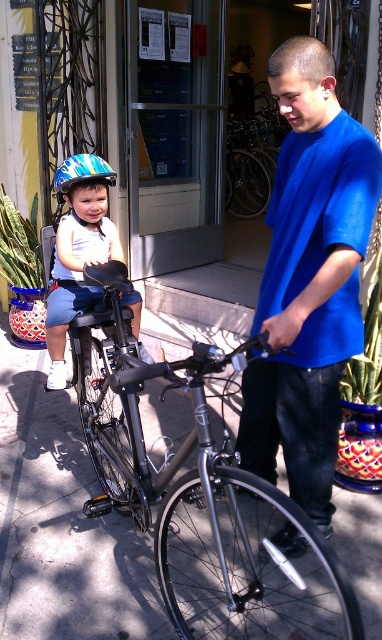
Does matte blue helmet at left have a greater width compared to blue and green striped bicycle helmet at left?

Yes.

In the scene shown: Does matte blue helmet at left have a greater height compared to blue and green striped bicycle helmet at left?

Correct, matte blue helmet at left is much taller as blue and green striped bicycle helmet at left.

The width and height of the screenshot is (382, 640). What are the coordinates of `matte blue helmet at left` in the screenshot? It's located at (77, 250).

How far apart are blue matte shirt at center and matte blue helmet at left?

They are 32.50 inches apart.

Does blue matte shirt at center appear on the right side of matte blue helmet at left?

Yes, blue matte shirt at center is to the right of matte blue helmet at left.

Does point (369, 221) come in front of point (72, 250)?

Yes, point (369, 221) is in front of point (72, 250).

Find the location of a particular element. The image size is (382, 640). blue matte shirt at center is located at coordinates (309, 280).

Can you confirm if shiny metallic bicycle at center is taller than blue matte shirt at center?

No, shiny metallic bicycle at center is not taller than blue matte shirt at center.

Can you confirm if shiny metallic bicycle at center is positioned to the right of blue matte shirt at center?

Incorrect, shiny metallic bicycle at center is not on the right side of blue matte shirt at center.

Between point (239, 561) and point (276, 300), which one is positioned behind?

Point (239, 561)

I want to click on shiny metallic bicycle at center, so click(202, 497).